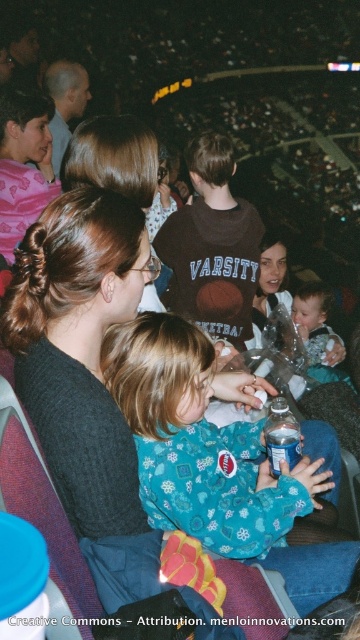
You are standing in the arena and want to locate the brown cotton shirt at center. Which direction should you look to find it?

The brown cotton shirt at center is located at point 0.384 on the x axis and 0.592 on the y axis, so you should look towards the center of the image to find it.

You are standing in the arena and want to locate the matte black shirt at upper left. According to the coordinates provided, where should you look to find it?

The matte black shirt at upper left is located at point coordinates [65,102].